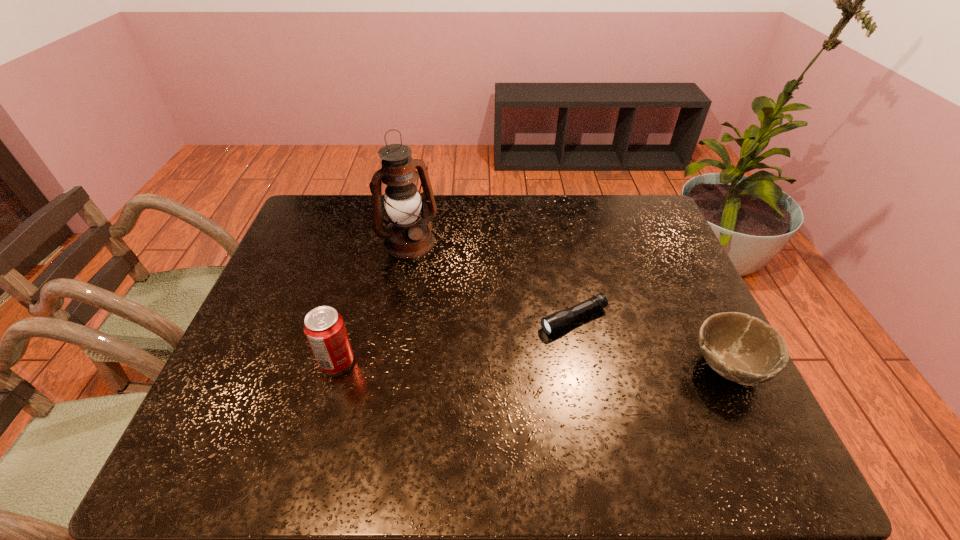
Identify the location of free space in the image that satisfies the following two spatial constraints: 1. on the back side of the second object from right to left; 2. on the left side of the soda. This screenshot has width=960, height=540. (349, 319).